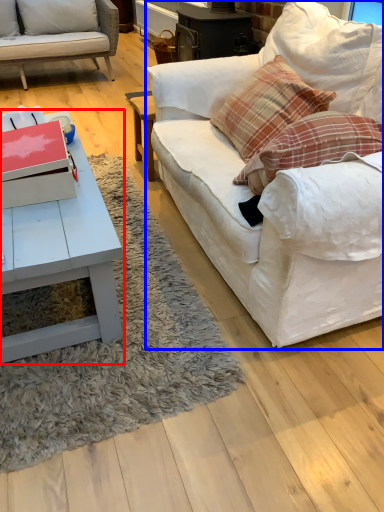
Question: Which point is closer to the camera, coffee table (highlighted by a red box) or studio couch (highlighted by a blue box)?

Choices:
 (A) coffee table
 (B) studio couch

Answer: (B)